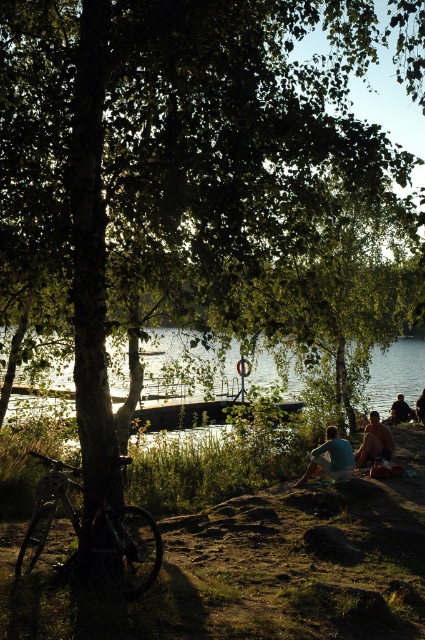
You are standing at the lakeside and see the shiny metallic bicycle at lower left and the dark blue jeans at lower right. Which object is positioned higher up from the ground?

The shiny metallic bicycle at lower left is positioned higher up from the ground than the dark blue jeans at lower right.

From the picture: You are a hiker who has just arrived at the lakeside and see the blue cotton shirt at center and the light brown wooden bench at lower right. Which object is closer to the tree where the bicycle is leaning?

The blue cotton shirt at center is closer to the tree where the bicycle is leaning because it is positioned to the left of the light brown wooden bench at lower right, which is farther away from the tree.